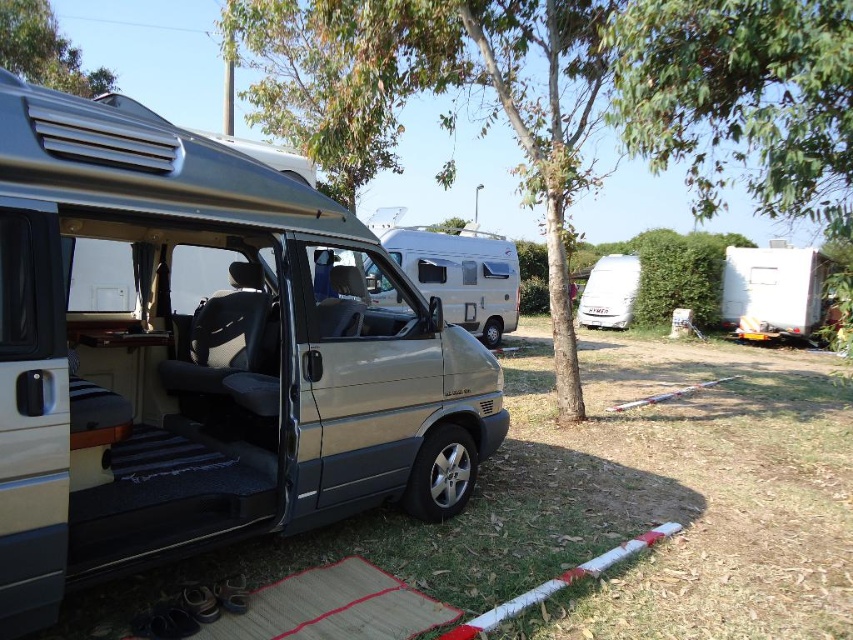
Consider the image. You are planning to park your 20 feet long truck between the silver metallic van at center and the white matte camper at right. According to the scene, is there enough space for your truck to fit between them without touching either vehicle?

The silver metallic van at center and white matte camper at right are 46.20 feet apart from each other. Since your truck is 20 feet long, there is sufficient space between them to park without touching either vehicle.

You are planning to park your car and need to know the relative positions of the silver metallic van at center and the white matte camper at right. Which van is closer to you?

The silver metallic van at center is closer to you because it is positioned over the white matte camper at right, indicating it is in front.

You are standing next to the metallic silver minivan at center and want to reach the white pole with red and white stripes. The path between them is clear. If your reach is 2 meters, can you touch the pole without moving from the minivan?

The metallic silver minivan at center and the white pole with red and white stripes are 2.34 meters apart. Since your reach is only 2 meters, you cannot touch the pole without moving from the metallic silver minivan at center.